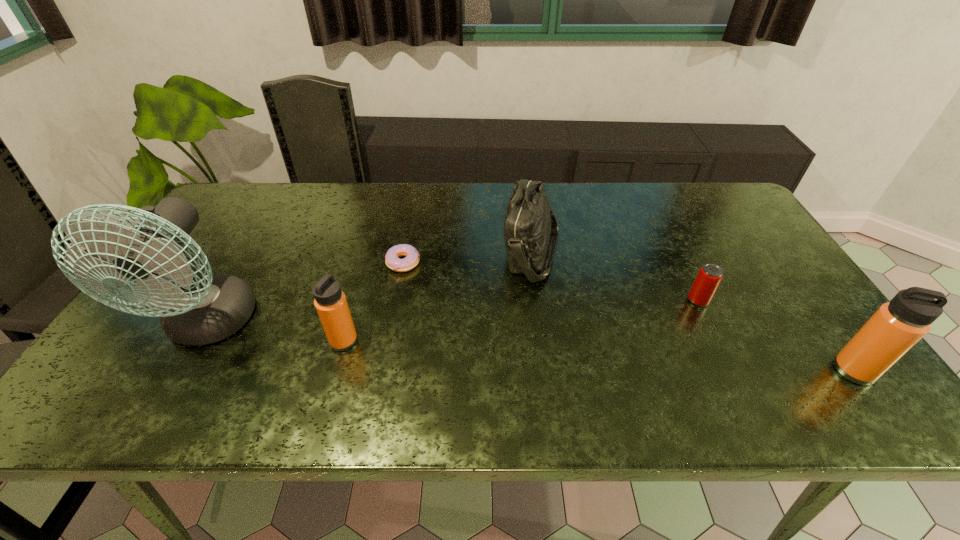
Please determine a free point for an extra thermos_bottle to ensure balance. Please provide its 2D coordinates. Your answer should be formatted as a tuple, i.e. [(x, y)], where the tuple contains the x and y coordinates of a point satisfying the conditions above.

[(591, 355)]